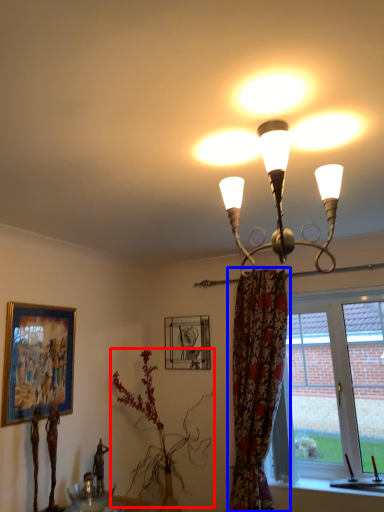
Question: Which point is further to the camera, plant (highlighted by a red box) or curtain (highlighted by a blue box)?

Choices:
 (A) plant
 (B) curtain

Answer: (A)